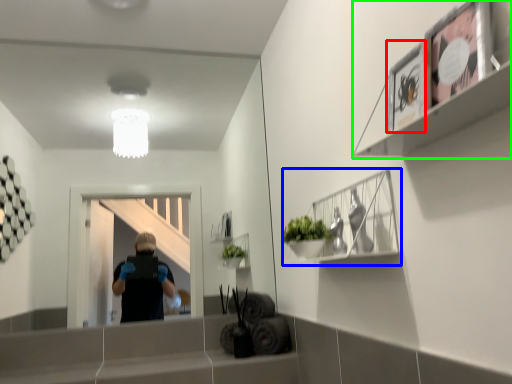
Question: Which object is positioned closest to picture frame (highlighted by a red box)? Select from cabinet (highlighted by a blue box) and shelf (highlighted by a green box).

Choices:
 (A) cabinet
 (B) shelf

Answer: (B)